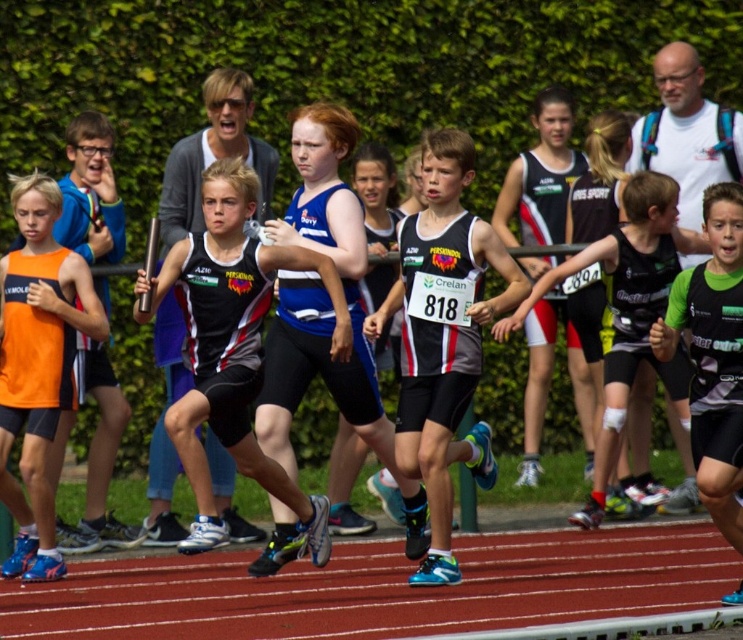
You are a photographer trying to capture the runner wearing the matte black running suit at center and the black matte tank top at center. Which clothing item is positioned higher on the runner?

The matte black running suit at center is positioned higher than the black matte tank top at center.

You are a photographer positioned at the starting line of the relay race. You want to capture a closeup shot of the black matte tank top at center. Given that your camera has a focal length of 200mm, which is optimal for capturing details from a distance, can you determine if the point at coordinates (629, 310) is within the camera frame? Please explain your reasoning.

The point at coordinates (629, 310) corresponds to the black matte tank top at center. Since the camera is set to 200mm focal length, which is suitable for capturing distant subjects in detail, the photographer can adjust the camera angle to ensure the black matte tank top at center is within the frame. Therefore, the point is within the camera frame.